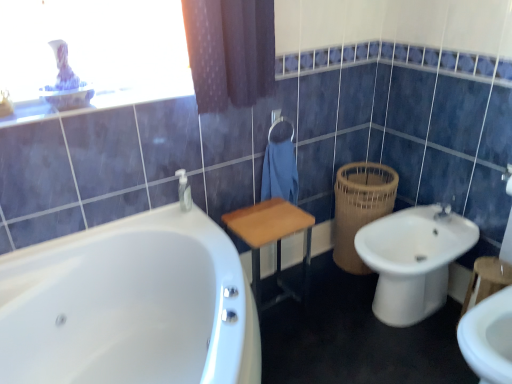
Question: Should I look upward or downward to see wooden table at center?

Choices:
 (A) up
 (B) down

Answer: (B)

Question: Does white glossy bathtub at lower left touch white ceramic bidet at lower right?

Choices:
 (A) yes
 (B) no

Answer: (B)

Question: Does white glossy bathtub at lower left appear on the right side of white ceramic bidet at lower right?

Choices:
 (A) no
 (B) yes

Answer: (A)

Question: Would you say white glossy bathtub at lower left is outside white ceramic bidet at lower right?

Choices:
 (A) yes
 (B) no

Answer: (A)

Question: Does white glossy bathtub at lower left come in front of white ceramic bidet at lower right?

Choices:
 (A) no
 (B) yes

Answer: (B)

Question: Is white glossy bathtub at lower left facing towards white ceramic bidet at lower right?

Choices:
 (A) yes
 (B) no

Answer: (B)

Question: Considering the relative sizes of white glossy bathtub at lower left and white ceramic bidet at lower right in the image provided, is white glossy bathtub at lower left shorter than white ceramic bidet at lower right?

Choices:
 (A) no
 (B) yes

Answer: (A)

Question: Is woven brown basket at right taller than wooden table at center?

Choices:
 (A) yes
 (B) no

Answer: (A)

Question: Does woven brown basket at right come in front of wooden table at center?

Choices:
 (A) yes
 (B) no

Answer: (B)

Question: Can you confirm if woven brown basket at right is bigger than wooden table at center?

Choices:
 (A) yes
 (B) no

Answer: (A)

Question: Considering the relative sizes of woven brown basket at right and wooden table at center in the image provided, is woven brown basket at right wider than wooden table at center?

Choices:
 (A) yes
 (B) no

Answer: (A)

Question: From the image's perspective, is woven brown basket at right below wooden table at center?

Choices:
 (A) no
 (B) yes

Answer: (A)

Question: Would you say woven brown basket at right is a long distance from wooden table at center?

Choices:
 (A) no
 (B) yes

Answer: (A)

Question: Considering the relative sizes of blue fabric towel at center and white ceramic bidet at lower right in the image provided, is blue fabric towel at center thinner than white ceramic bidet at lower right?

Choices:
 (A) yes
 (B) no

Answer: (A)